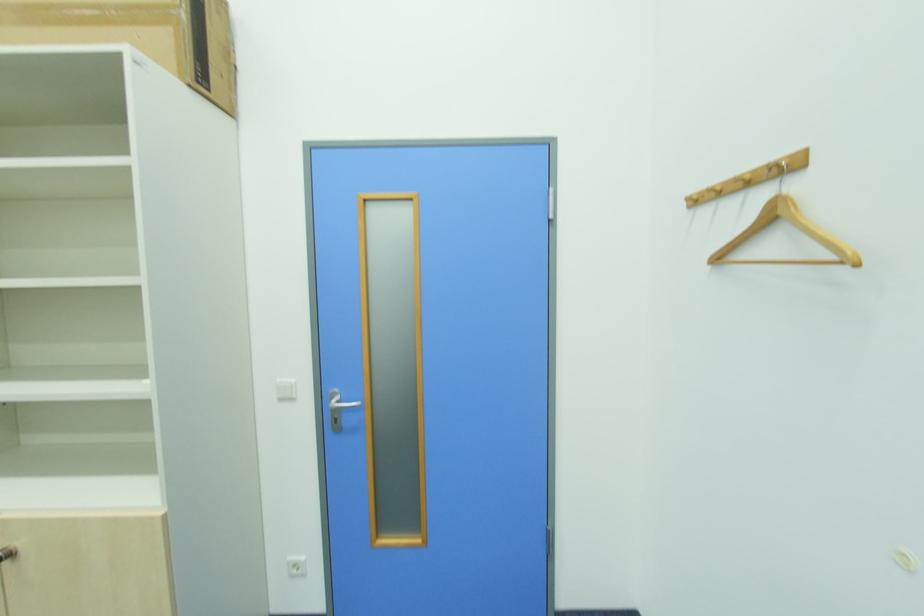
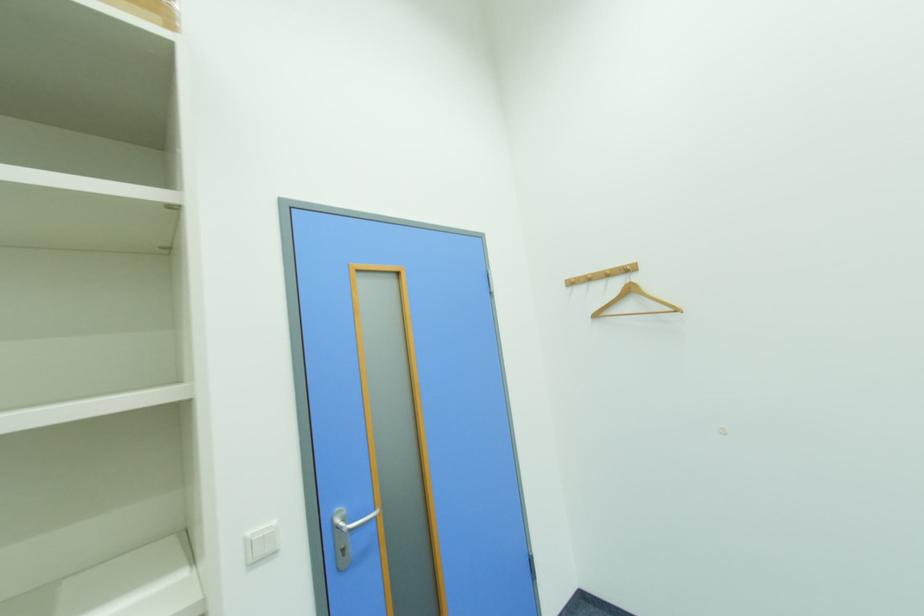
The point at (339, 419) is marked in the first image. Where is the corresponding point in the second image?

(347, 551)